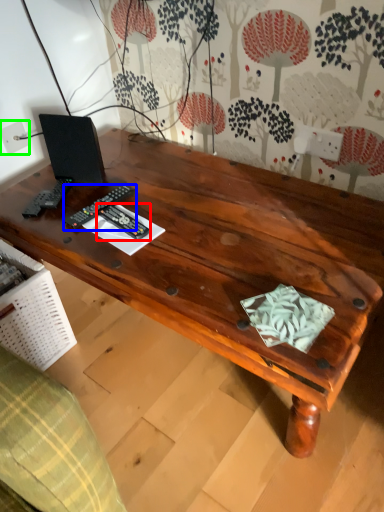
Question: Which object is the farthest from control (highlighted by a red box)? Choose among these: control (highlighted by a blue box) or electric outlet (highlighted by a green box).

Choices:
 (A) control
 (B) electric outlet

Answer: (B)